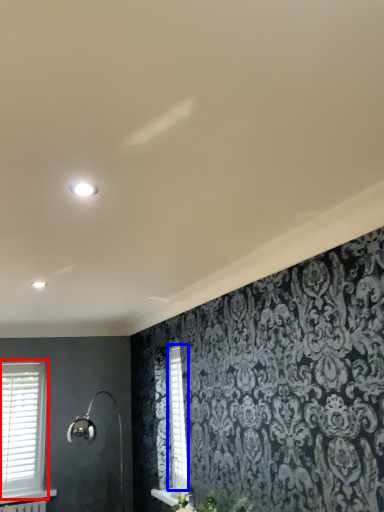
Question: Which object is further to the camera taking this photo, window (highlighted by a red box) or shutter (highlighted by a blue box)?

Choices:
 (A) window
 (B) shutter

Answer: (A)